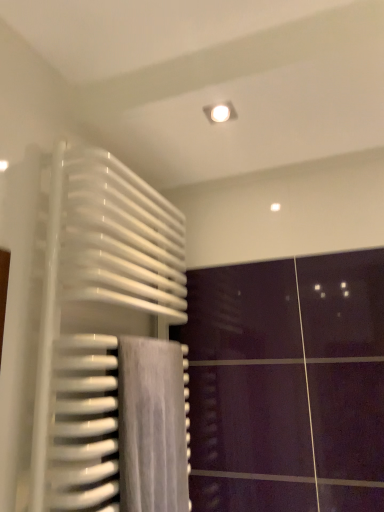
Question: From a real-world perspective, is white glossy radiator at left positioned above or below gray fabric towel at lower left?

Choices:
 (A) above
 (B) below

Answer: (A)

Question: Considering the positions of point (84, 245) and point (125, 444), is point (84, 245) closer or farther from the camera than point (125, 444)?

Choices:
 (A) farther
 (B) closer

Answer: (A)

Question: Looking at their shapes, would you say white glossy radiator at left is wider or thinner than gray fabric towel at lower left?

Choices:
 (A) thin
 (B) wide

Answer: (B)

Question: Considering the positions of gray fabric towel at lower left and white glossy radiator at left in the image, is gray fabric towel at lower left taller or shorter than white glossy radiator at left?

Choices:
 (A) short
 (B) tall

Answer: (A)

Question: Is gray fabric towel at lower left spatially inside white glossy radiator at left, or outside of it?

Choices:
 (A) inside
 (B) outside

Answer: (A)

Question: Considering the positions of point (163, 432) and point (92, 271), is point (163, 432) closer or farther from the camera than point (92, 271)?

Choices:
 (A) closer
 (B) farther

Answer: (B)

Question: In terms of size, does gray fabric towel at lower left appear bigger or smaller than white glossy radiator at left?

Choices:
 (A) big
 (B) small

Answer: (B)